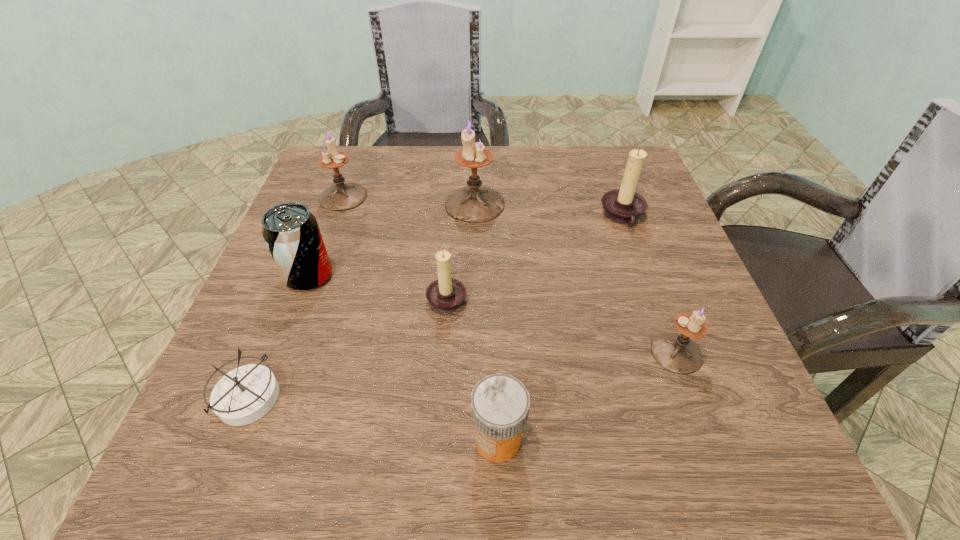
Locate an element on the screen. The height and width of the screenshot is (540, 960). the nearer brown candle holder is located at coordinates (446, 294).

Where is `orange medicine`? The image size is (960, 540). orange medicine is located at coordinates (500, 403).

Where is `the shortest object`? This screenshot has height=540, width=960. the shortest object is located at coordinates (244, 395).

The image size is (960, 540). What are the coordinates of `free space located on the left of the biggest purple candle holder` in the screenshot? It's located at (423, 204).

Identify the location of vacant space located 0.180m on the front of the leftmost candle holder. The image size is (960, 540). (319, 266).

This screenshot has height=540, width=960. What are the coordinates of `vacant space located 0.290m on the wick of the right brown candle holder` in the screenshot? It's located at (473, 217).

Locate an element on the screen. The height and width of the screenshot is (540, 960). vacant space situated 0.090m on the wick of the right brown candle holder is located at coordinates (562, 217).

This screenshot has width=960, height=540. Identify the location of vacant region located 0.340m on the wick of the right brown candle holder. (451, 217).

I want to click on vacant space located 0.200m on the back of the soda can, so click(337, 201).

Identify the location of vacant region located 0.140m on the back of the rightmost purple candle holder. (648, 276).